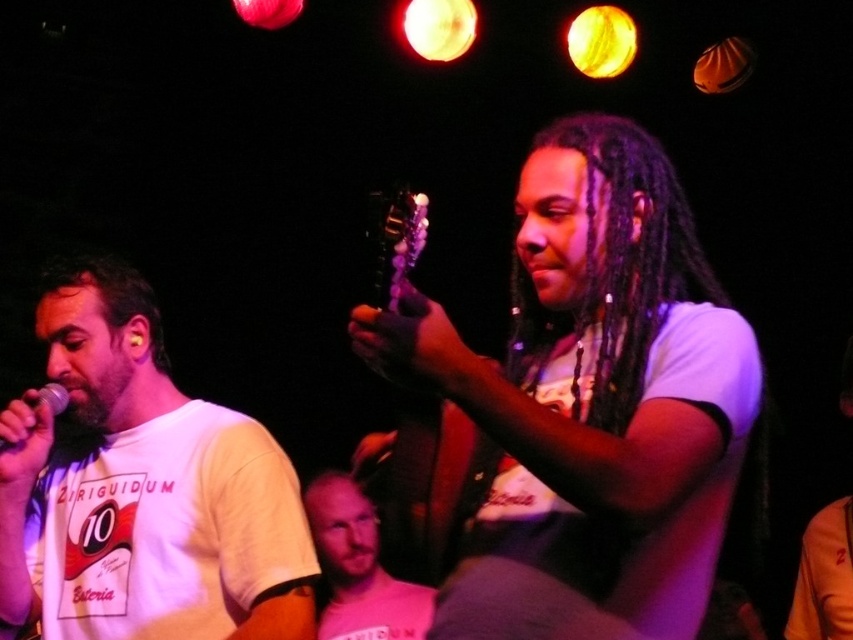
You are standing in the audience and want to take a photo of the performer playing the guitar. You notice two points marked on the stage. Which point is closer to you, point at (444, 476) or point at (375, 563)?

Point at (444, 476) is closer to you than point at (375, 563).